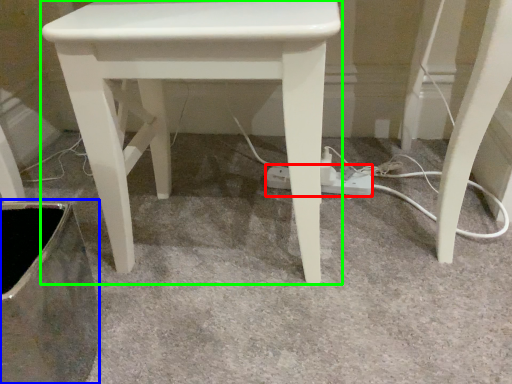
Question: Which object is the farthest from extension cord (highlighted by a red box)? Choose among these: swivel chair (highlighted by a blue box) or stool (highlighted by a green box).

Choices:
 (A) swivel chair
 (B) stool

Answer: (A)